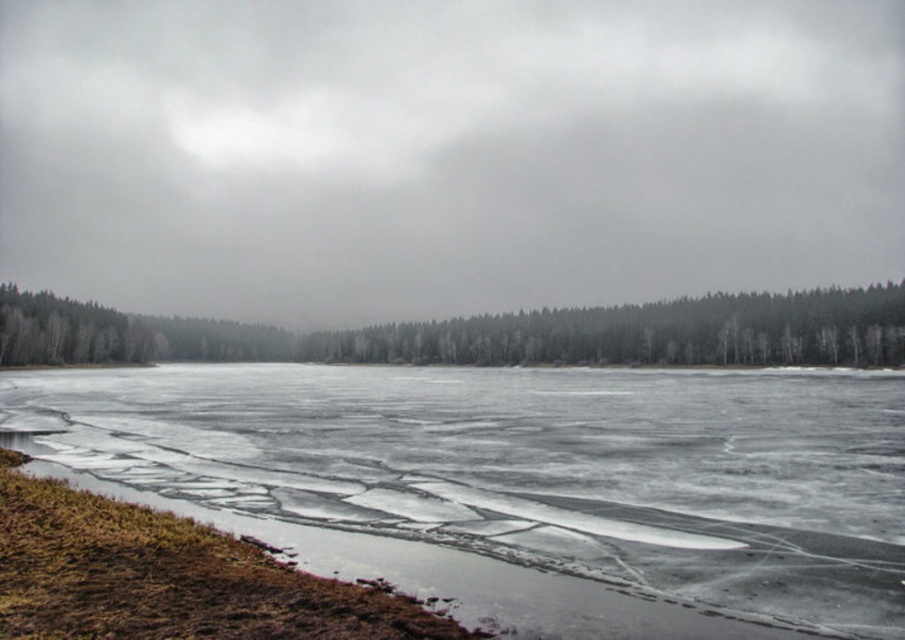
Question: Which point appears closest to the camera in this image?

Choices:
 (A) (865, 417)
 (B) (341, 358)

Answer: (A)

Question: Does translucent ice at lower left appear on the right side of green matte trees at center?

Choices:
 (A) yes
 (B) no

Answer: (A)

Question: Is translucent ice at lower left below green matte trees at center?

Choices:
 (A) yes
 (B) no

Answer: (A)

Question: Which point is farther to the camera?

Choices:
 (A) (277, 344)
 (B) (414, 580)

Answer: (A)

Question: Can you confirm if translucent ice at lower left is thinner than green matte trees at center?

Choices:
 (A) no
 (B) yes

Answer: (B)